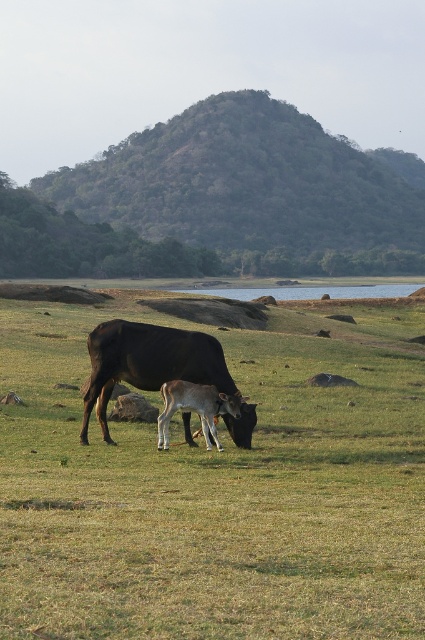
Is point (119, 486) less distant than point (302, 298)?

That is True.

Is green grassy field at center positioned in front of clear water at center?

That is True.

Is point (107, 556) closer to viewer compared to point (195, 291)?

That is True.

Locate an element on the screen. The width and height of the screenshot is (425, 640). green grassy field at center is located at coordinates (215, 492).

Is green grassy field at center shorter than shiny black cow at center?

No.

Does green grassy field at center lie in front of shiny black cow at center?

Yes, it is in front of shiny black cow at center.

Between point (339, 627) and point (172, 332), which one is positioned behind?

Point (172, 332)

Find the location of `green grassy field at center`. green grassy field at center is located at coordinates (215, 492).

Is point (175, 381) positioned after point (323, 291)?

No, (175, 381) is closer to viewer.

Who is higher up, white smooth calf at center or clear water at center?

clear water at center is higher up.

Who is more distant from viewer, (189,406) or (371,288)?

Positioned behind is point (371,288).

This screenshot has height=640, width=425. I want to click on white smooth calf at center, so click(195, 408).